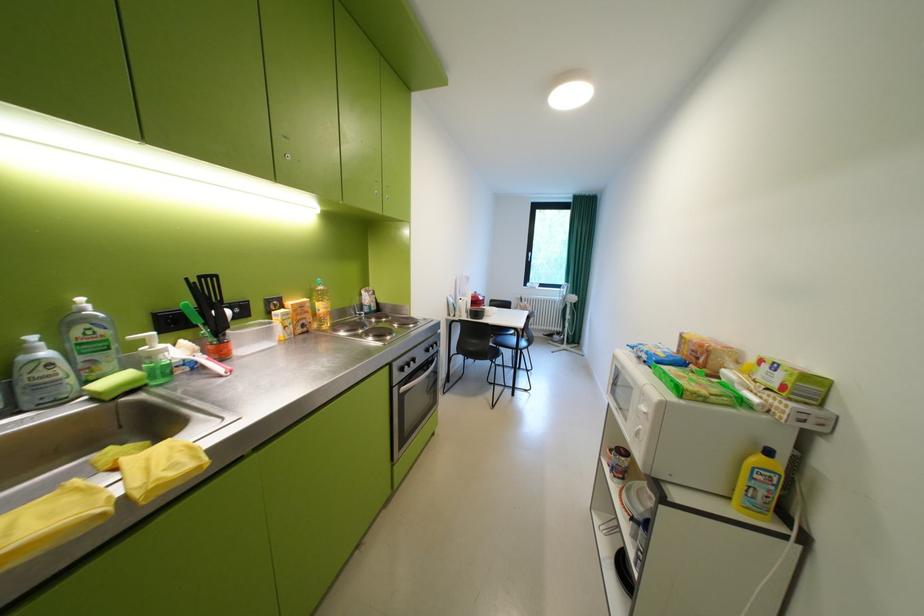
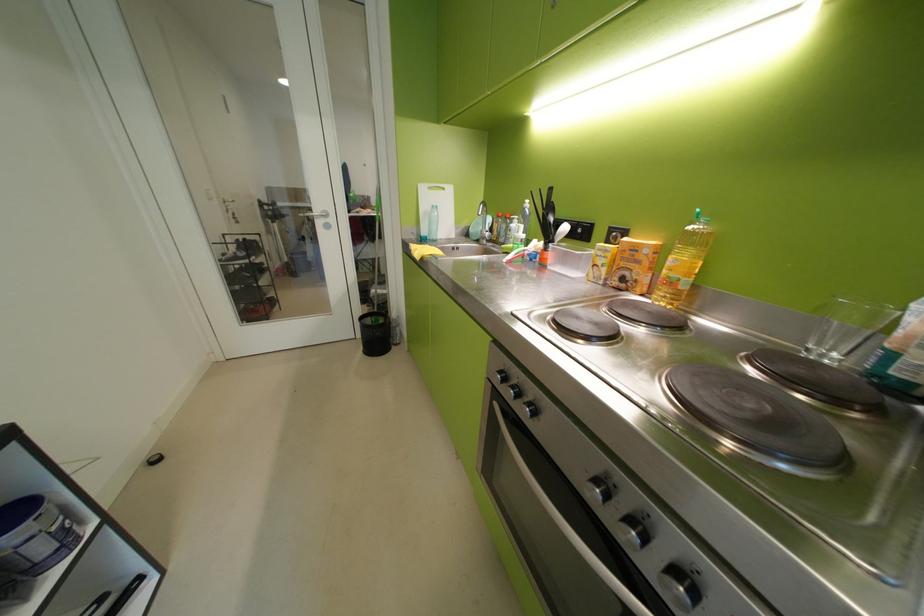
In the second image, find the point that corresponds to (244,345) in the first image.

(561, 256)